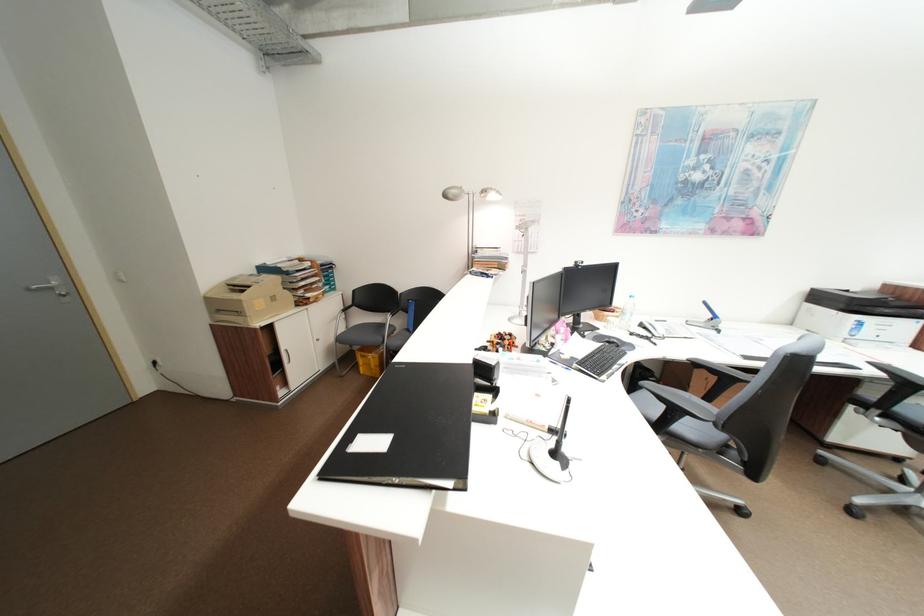
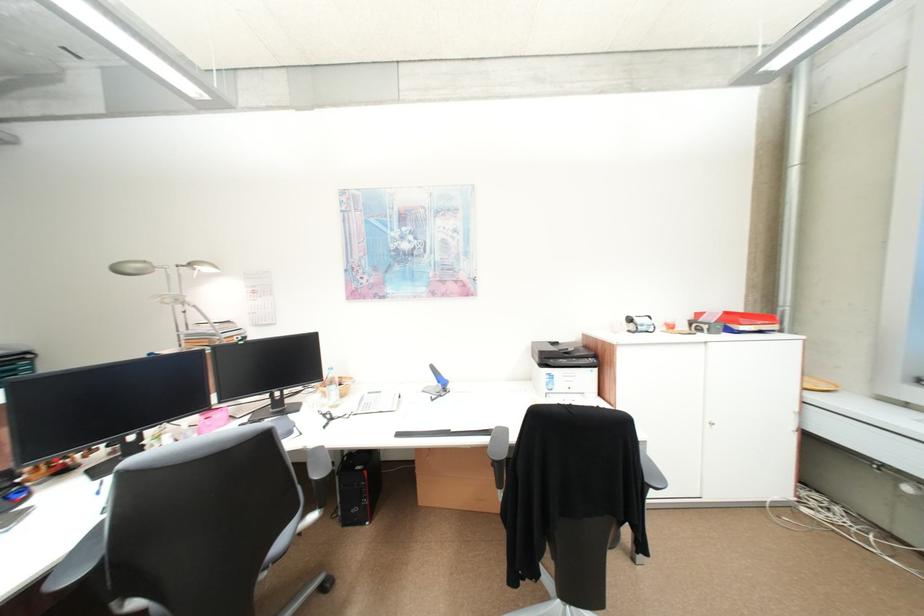
Question: Which direction would the cameraman need to move to produce the second image? Reply with the corresponding letter.

Choices:
 (A) Left
 (B) Right
 (C) Forward
 (D) Backward

Answer: (B)